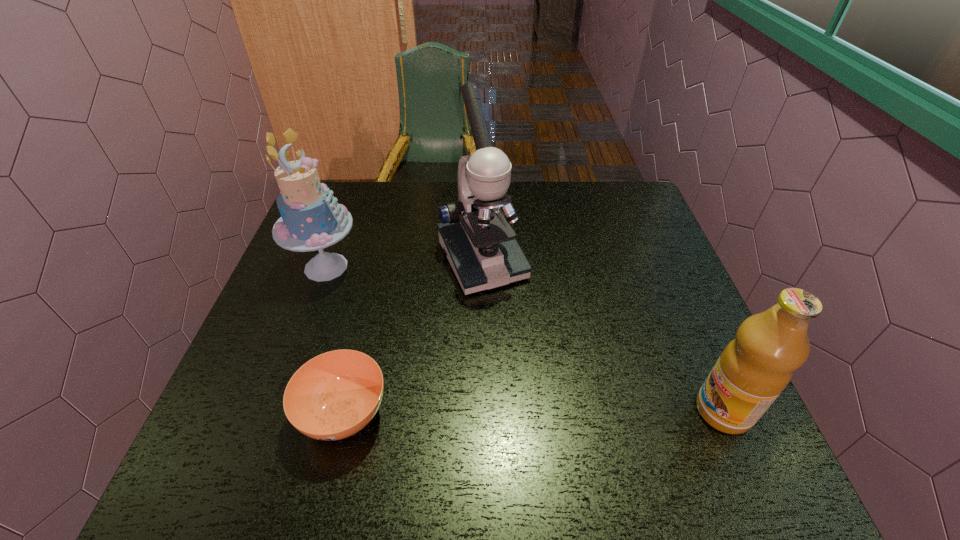
Where is `free location that satisfies the following two spatial constraints: 1. on the back side of the soup bowl; 2. on the label of the third tallest object`? free location that satisfies the following two spatial constraints: 1. on the back side of the soup bowl; 2. on the label of the third tallest object is located at coordinates (345, 411).

Identify the location of free space that satisfies the following two spatial constraints: 1. on the back side of the shortest object; 2. on the right side of the second object from right to left. The height and width of the screenshot is (540, 960). (381, 261).

The image size is (960, 540). I want to click on vacant point that satisfies the following two spatial constraints: 1. on the front side of the olive oil; 2. on the label of the second tallest object, so click(x=273, y=411).